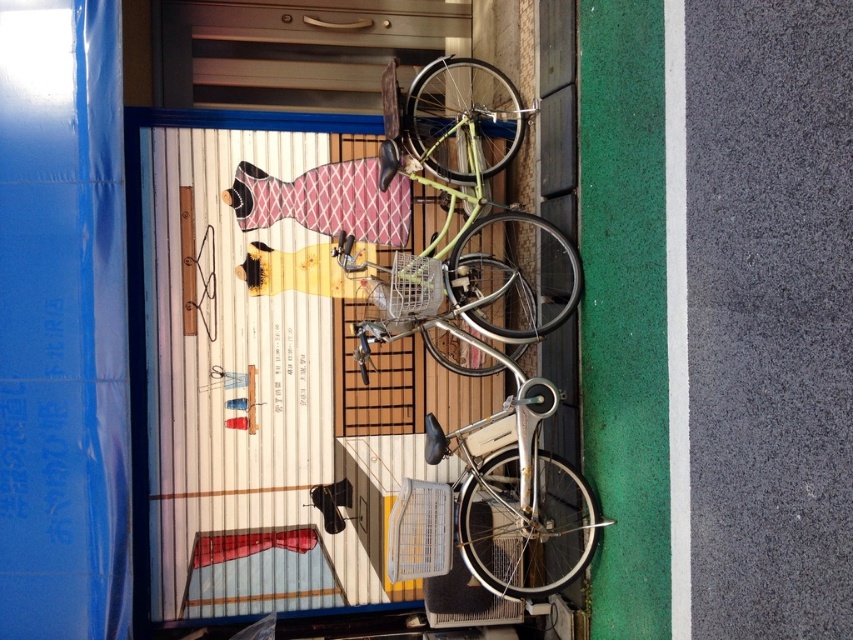
Find the location of a particular element. The image size is (853, 640). metallic silver door at center is located at coordinates (260, 394).

Does metallic silver door at center have a greater height compared to metallic wire basket at center?

Yes.

In order to click on metallic silver door at center in this screenshot , I will do `click(260, 394)`.

Can you confirm if light green matte bicycle at center is positioned above metallic wire basket at center?

Yes, light green matte bicycle at center is above metallic wire basket at center.

Which is below, light green matte bicycle at center or metallic wire basket at center?

Positioned lower is metallic wire basket at center.

Between point (523, 122) and point (410, 312), which one is positioned behind?

Positioned behind is point (523, 122).

Identify the location of light green matte bicycle at center. coord(465,218).

Does plastic basket at center lie in front of metallic wire basket at center?

Yes, plastic basket at center is in front of metallic wire basket at center.

Who is more forward, (x=436, y=513) or (x=367, y=284)?

Positioned in front is point (x=436, y=513).

Between point (425, 540) and point (384, 284), which one is positioned behind?

The point (384, 284) is behind.

Where is `plastic basket at center`? plastic basket at center is located at coordinates (421, 531).